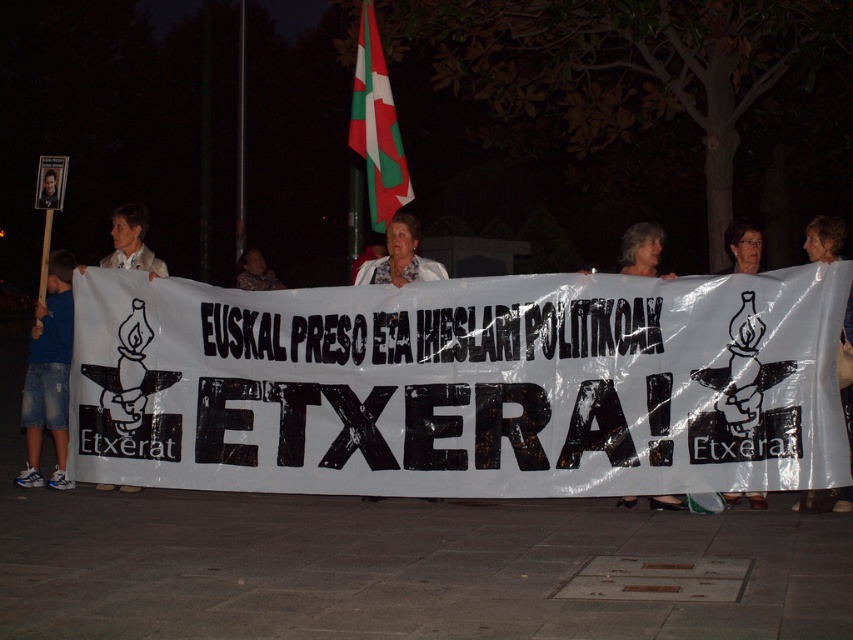
Which is behind, point (387, 168) or point (825, 243)?

Point (387, 168)

The image size is (853, 640). Find the location of `green and white fabric flag at upper center`. green and white fabric flag at upper center is located at coordinates (376, 125).

Does green and white fabric flag at upper center lie behind camouflage fabric shirt at center?

No, it is in front of camouflage fabric shirt at center.

At what (x,y) coordinates should I click in order to perform the action: click on green and white fabric flag at upper center. Please return your answer as a coordinate pair (x, y). The width and height of the screenshot is (853, 640). Looking at the image, I should click on pyautogui.click(x=376, y=125).

This screenshot has height=640, width=853. In order to click on green and white fabric flag at upper center in this screenshot , I will do `click(376, 125)`.

Which of these two, blue denim shorts at left or camouflage fabric shirt at center, stands shorter?

With less height is camouflage fabric shirt at center.

Can you confirm if blue denim shorts at left is positioned above camouflage fabric shirt at center?

No, blue denim shorts at left is not above camouflage fabric shirt at center.

In order to click on blue denim shorts at left in this screenshot , I will do `click(49, 374)`.